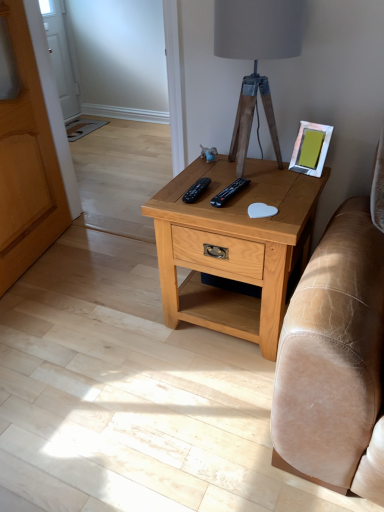
Locate an element on the screen. Image resolution: width=384 pixels, height=512 pixels. vacant space underneath wooden tripod lamp at center (from a real-world perspective) is located at coordinates (263, 166).